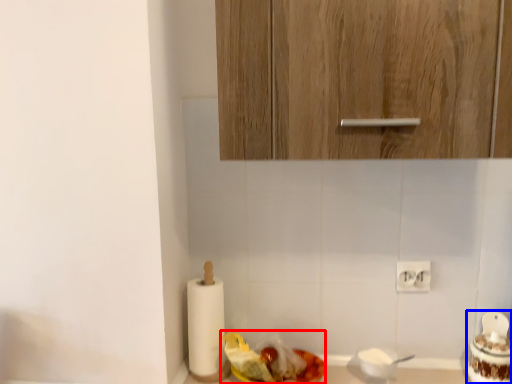
Question: Which of the following is the farthest to the observer, food (highlighted by a red box) or food (highlighted by a blue box)?

Choices:
 (A) food
 (B) food

Answer: (B)